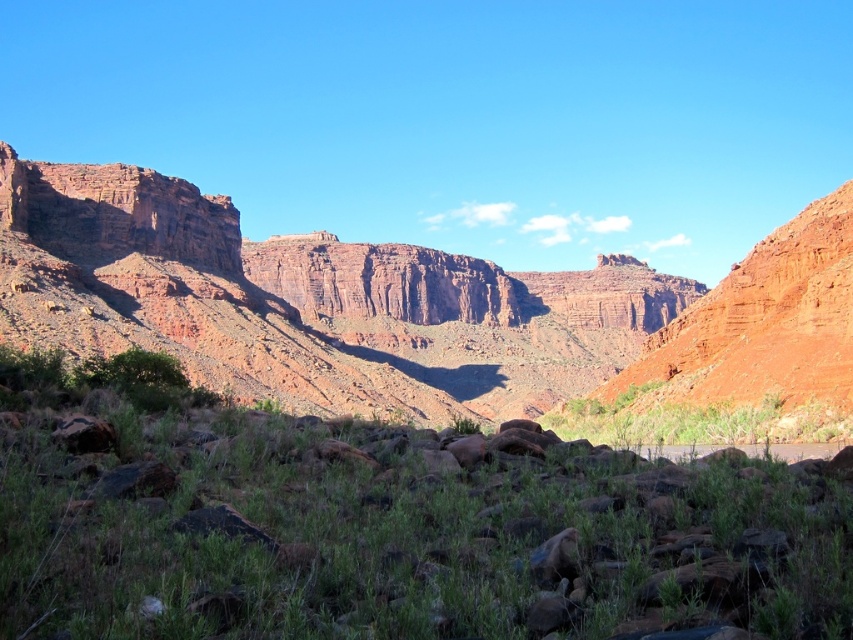
Is green grassy at center to the left of green leafy shrubs at center from the viewer's perspective?

Indeed, green grassy at center is positioned on the left side of green leafy shrubs at center.

Is point (489, 572) behind point (695, 412)?

No, it is in front of (695, 412).

Does point (560, 454) lie behind point (834, 417)?

No, (560, 454) is in front of (834, 417).

Locate an element on the screen. Image resolution: width=853 pixels, height=640 pixels. green grassy at center is located at coordinates (384, 525).

Is green grassy at center to the left of rustic rock formation at center from the viewer's perspective?

Correct, you'll find green grassy at center to the left of rustic rock formation at center.

Does green grassy at center have a lesser width compared to rustic rock formation at center?

Correct, green grassy at center's width is less than rustic rock formation at center's.

Is point (125, 557) positioned behind point (535, 356)?

No, it is in front of (535, 356).

The width and height of the screenshot is (853, 640). What are the coordinates of `green grassy at center` in the screenshot? It's located at (384, 525).

Can you confirm if rustic rock formation at center is bigger than green leafy shrubs at center?

Yes.

Does point (115, 220) come farther from viewer compared to point (636, 428)?

Yes, point (115, 220) is farther from viewer.

Identify the location of rustic rock formation at center. The width and height of the screenshot is (853, 640). (402, 305).